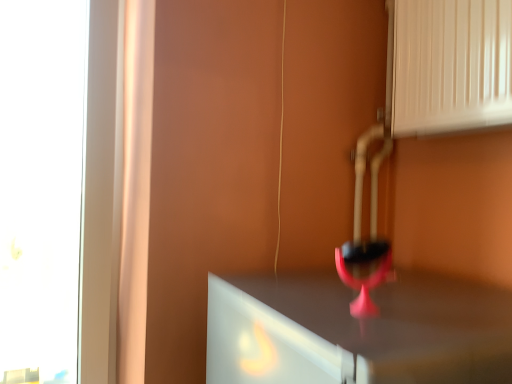
What do you see at coordinates (364, 285) in the screenshot?
I see `pink matte wine glass at center` at bounding box center [364, 285].

What is the approximate width of pink matte wine glass at center?

The width of pink matte wine glass at center is 3.41 inches.

You are a GUI agent. You are given a task and a screenshot of the screen. Output one action in this format:
    pyautogui.click(x=<x>, y=<y>)
    Task: Click on the pink matte wine glass at center
    This screenshot has width=512, height=384.
    Given the screenshot: What is the action you would take?
    pyautogui.click(x=364, y=285)

What is the approximate height of pink matte wine glass at center?

pink matte wine glass at center is 4.38 inches in height.

The image size is (512, 384). Describe the element at coordinates (448, 65) in the screenshot. I see `white glossy vent at upper right` at that location.

Image resolution: width=512 pixels, height=384 pixels. What are the coordinates of `white glossy vent at upper right` in the screenshot? It's located at (448, 65).

Locate an element on the screen. The width and height of the screenshot is (512, 384). pink matte wine glass at center is located at coordinates (364, 285).

Is white glossy vent at upper right to the left of pink matte wine glass at center from the viewer's perspective?

In fact, white glossy vent at upper right is to the right of pink matte wine glass at center.

Relative to pink matte wine glass at center, is white glossy vent at upper right in front or behind?

white glossy vent at upper right is positioned farther from the viewer than pink matte wine glass at center.

Which is less distant, (x=413, y=114) or (x=365, y=286)?

Point (x=413, y=114) appears to be farther away from the viewer than point (x=365, y=286).

From the image's perspective, between white glossy vent at upper right and pink matte wine glass at center, who is located below?

pink matte wine glass at center is shown below in the image.

From a real-world perspective, is white glossy vent at upper right over pink matte wine glass at center?

Yes.

Which of these two, white glossy vent at upper right or pink matte wine glass at center, is thinner?

With smaller width is pink matte wine glass at center.

Considering the sizes of objects white glossy vent at upper right and pink matte wine glass at center in the image provided, who is shorter, white glossy vent at upper right or pink matte wine glass at center?

pink matte wine glass at center is shorter.

Is white glossy vent at upper right smaller than pink matte wine glass at center?

No.

Is pink matte wine glass at center a part of white glossy vent at upper right?

No, pink matte wine glass at center is located outside of white glossy vent at upper right.

Would you say white glossy vent at upper right is a long distance from pink matte wine glass at center?

white glossy vent at upper right is near pink matte wine glass at center, not far away.

Is white glossy vent at upper right positioned with its back to pink matte wine glass at center?

No, pink matte wine glass at center is not at the back of white glossy vent at upper right.

How distant is white glossy vent at upper right from pink matte wine glass at center?

19.70 inches.

This screenshot has height=384, width=512. In order to click on wine glass lying in front of the white glossy vent at upper right in this screenshot , I will do `click(364, 285)`.

Can you confirm if pink matte wine glass at center is positioned to the left of white glossy vent at upper right?

Yes.

Does pink matte wine glass at center lie behind white glossy vent at upper right?

No, pink matte wine glass at center is in front of white glossy vent at upper right.

Considering the positions of points (357, 313) and (411, 21), is point (357, 313) closer to camera compared to point (411, 21)?

Yes, it is.

From the image's perspective, which is above, pink matte wine glass at center or white glossy vent at upper right?

white glossy vent at upper right appears higher in the image.

From a real-world perspective, is pink matte wine glass at center under white glossy vent at upper right?

Yes.

Considering the sizes of objects pink matte wine glass at center and white glossy vent at upper right in the image provided, who is thinner, pink matte wine glass at center or white glossy vent at upper right?

pink matte wine glass at center.

Is pink matte wine glass at center shorter than white glossy vent at upper right?

Correct, pink matte wine glass at center is not as tall as white glossy vent at upper right.

Does pink matte wine glass at center have a smaller size compared to white glossy vent at upper right?

Yes, pink matte wine glass at center is smaller than white glossy vent at upper right.

Do you think pink matte wine glass at center is within white glossy vent at upper right, or outside of it?

The correct answer is: outside.

Are pink matte wine glass at center and white glossy vent at upper right making contact?

There is a gap between pink matte wine glass at center and white glossy vent at upper right.

Is pink matte wine glass at center turned away from white glossy vent at upper right?

No, pink matte wine glass at center's orientation is not away from white glossy vent at upper right.

How distant is pink matte wine glass at center from white glossy vent at upper right?

pink matte wine glass at center is 19.70 inches away from white glossy vent at upper right.

Find the location of `vent above the pink matte wine glass at center (from the image's perspective)`. vent above the pink matte wine glass at center (from the image's perspective) is located at coordinates (448, 65).

In order to click on wine glass that is below the white glossy vent at upper right (from the image's perspective) in this screenshot , I will do `click(364, 285)`.

In the image, there is a white glossy vent at upper right. Identify the location of wine glass below it (from a real-world perspective). (364, 285).